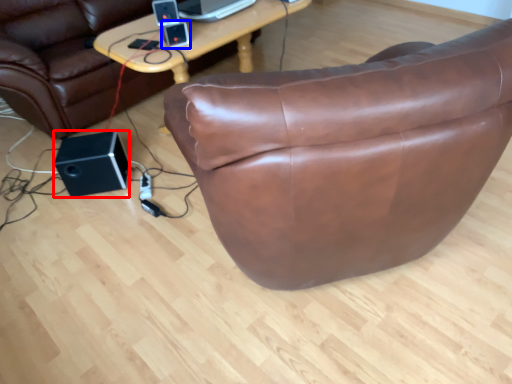
Question: Which of the following is the farthest to the observer, speaker (highlighted by a red box) or ipod (highlighted by a blue box)?

Choices:
 (A) speaker
 (B) ipod

Answer: (A)